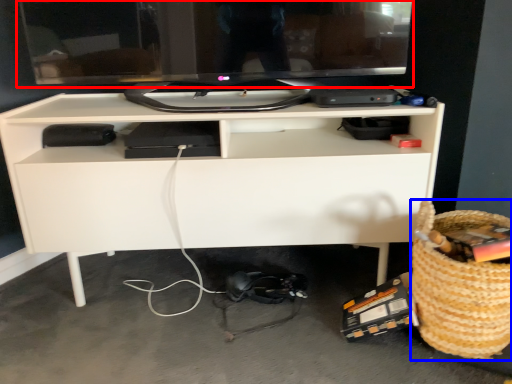
Question: Which object appears closest to the camera in this image, computer monitor (highlighted by a red box) or basket (highlighted by a blue box)?

Choices:
 (A) computer monitor
 (B) basket

Answer: (B)